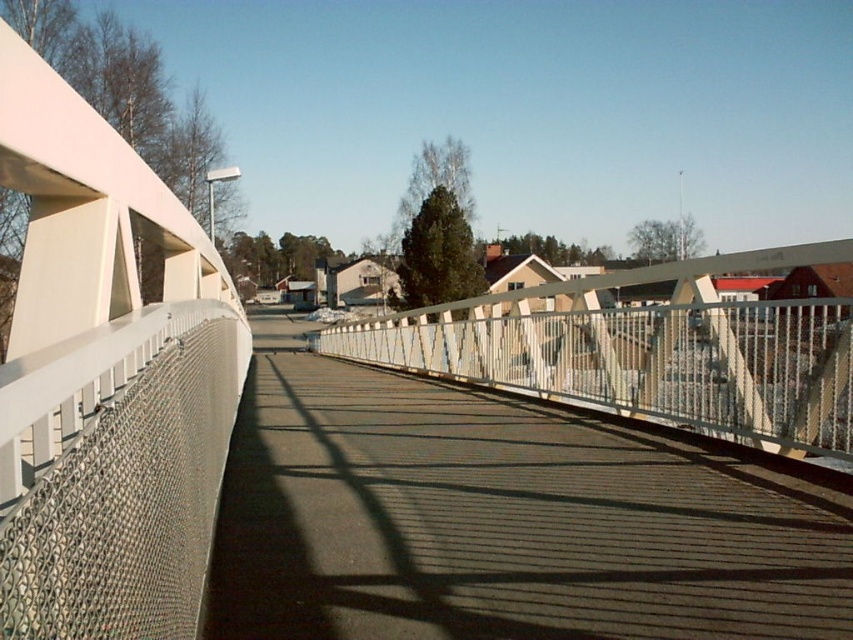
Question: Can you confirm if metallic mesh at center is positioned above metallic mesh railing at center?

Choices:
 (A) no
 (B) yes

Answer: (A)

Question: Observing the image, what is the correct spatial positioning of metallic mesh at center in reference to metallic mesh railing at center?

Choices:
 (A) below
 (B) above

Answer: (A)

Question: Which point is farther to the camera?

Choices:
 (A) metallic mesh railing at center
 (B) metallic mesh at center

Answer: (A)

Question: Is metallic mesh at center behind metallic mesh railing at center?

Choices:
 (A) no
 (B) yes

Answer: (A)

Question: Which object is farther from the camera taking this photo?

Choices:
 (A) metallic mesh at center
 (B) metallic mesh railing at center

Answer: (B)

Question: Which object appears farthest from the camera in this image?

Choices:
 (A) metallic mesh at center
 (B) metallic mesh railing at center

Answer: (B)